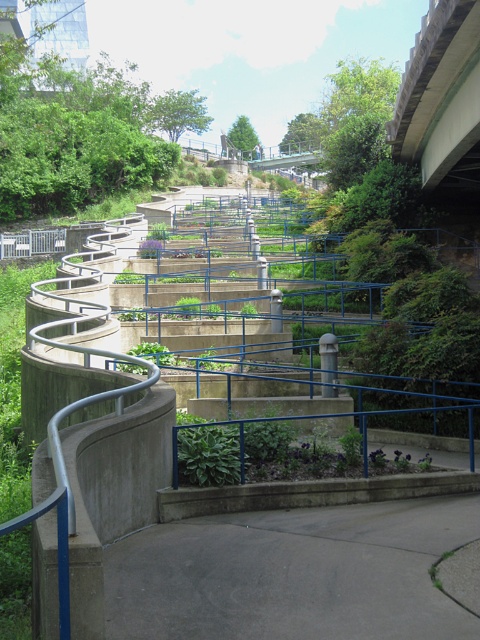
Can you confirm if gray concrete path at lower center is positioned to the left of concrete bridge at upper right?

Yes, gray concrete path at lower center is to the left of concrete bridge at upper right.

In the scene shown: Who is lower down, gray concrete path at lower center or concrete bridge at upper right?

Positioned lower is gray concrete path at lower center.

Who is more forward, [256,605] or [435,96]?

Point [256,605]

I want to click on gray concrete path at lower center, so click(x=292, y=573).